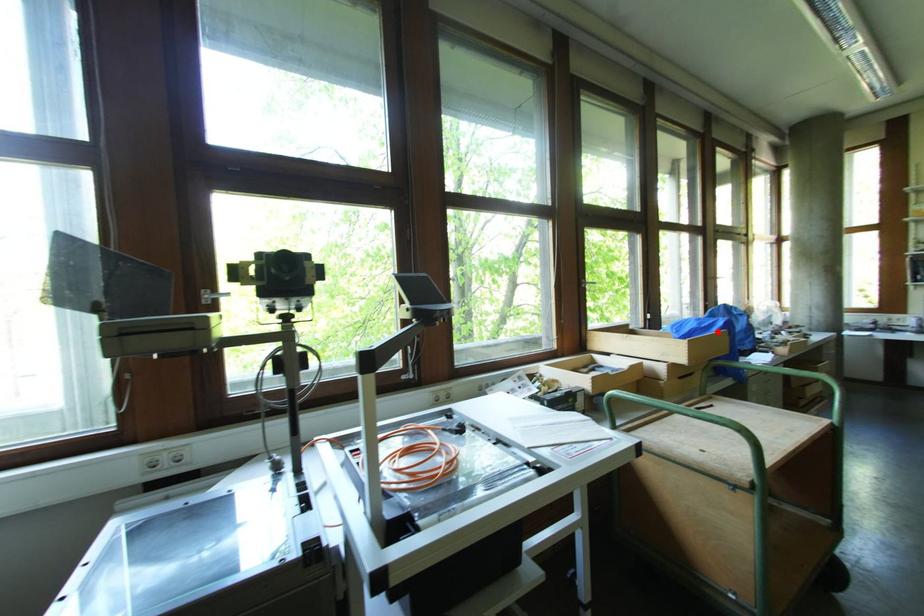
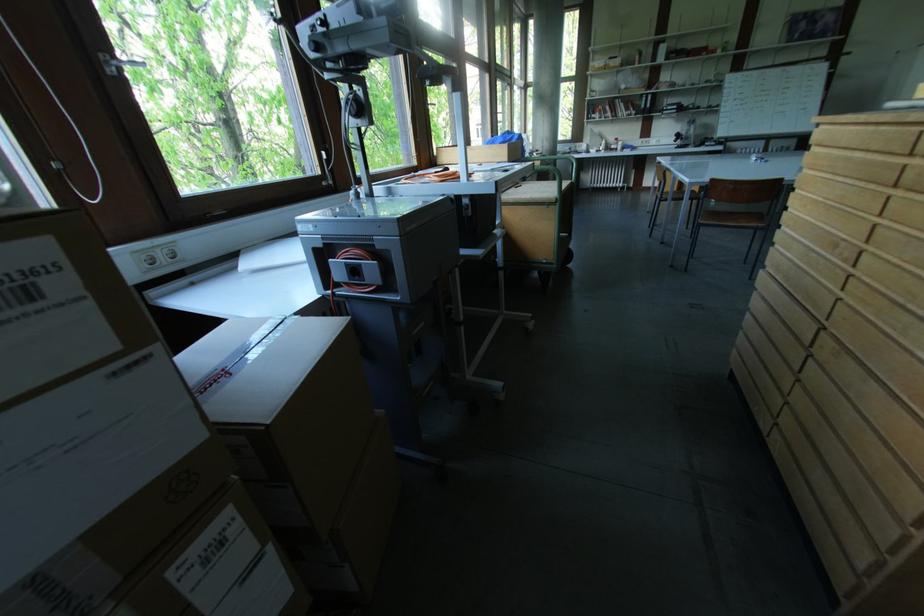
The point at the highlighted location is marked in the first image. Where is the corresponding point in the second image?

(516, 144)